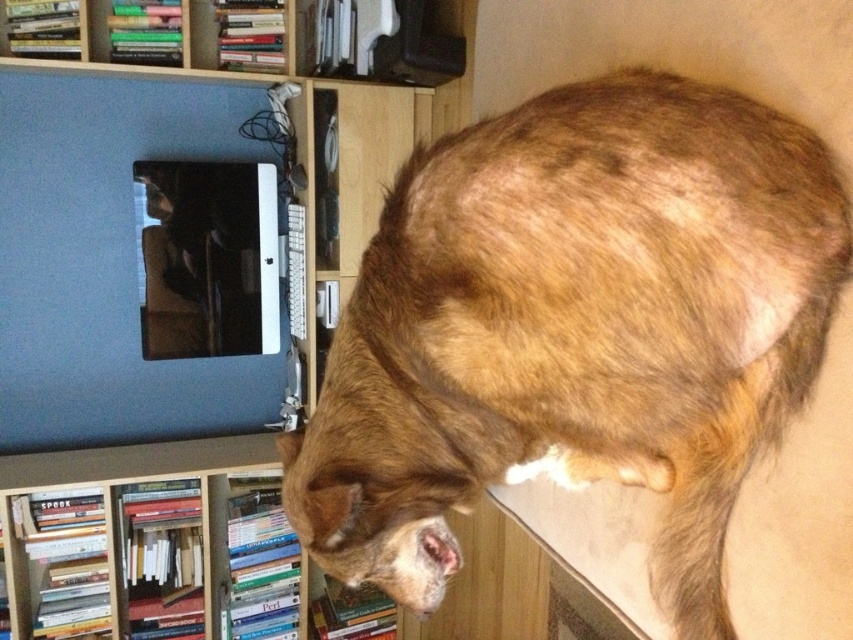
Question: Is brown fur at upper right wider than matte blue monitor at upper left?

Choices:
 (A) yes
 (B) no

Answer: (B)

Question: Which point appears farthest from the camera in this image?

Choices:
 (A) 312,392
 (B) 345,316

Answer: (A)

Question: Which object appears closest to the camera in this image?

Choices:
 (A) matte blue monitor at upper left
 (B) brown fur at upper right

Answer: (B)

Question: Considering the relative positions of brown fur at upper right and matte blue monitor at upper left in the image provided, where is brown fur at upper right located with respect to matte blue monitor at upper left?

Choices:
 (A) above
 (B) below

Answer: (B)

Question: In this image, where is brown fur at upper right located relative to wooden bookshelf at lower left?

Choices:
 (A) below
 (B) above

Answer: (B)

Question: Which object is closer to the camera taking this photo?

Choices:
 (A) matte blue monitor at upper left
 (B) brown fur at upper right
 (C) wooden bookshelf at lower left

Answer: (B)